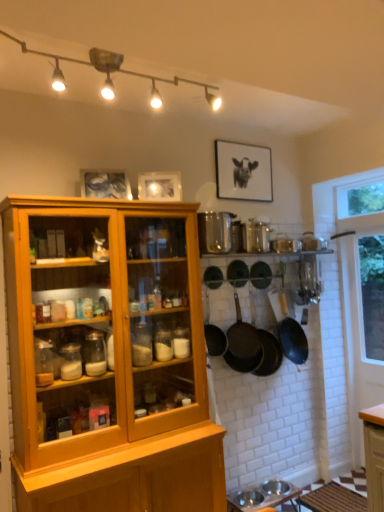
Question: Is black matte picture frame at upper center, which is counted as the 1th picture frame, starting from the right, aimed at black matte frying pan at center, marked as the 5th frying pan in a right-to-left arrangement?

Choices:
 (A) yes
 (B) no

Answer: (B)

Question: Does black matte picture frame at upper center, which is counted as the 1th picture frame, starting from the right, have a larger size compared to black matte frying pan at center, marked as the 5th frying pan in a right-to-left arrangement?

Choices:
 (A) no
 (B) yes

Answer: (A)

Question: Is black matte frying pan at center, marked as the 2th frying pan in a left-to-right arrangement, located within black matte picture frame at upper center, which ranks as the third picture frame in left-to-right order?

Choices:
 (A) no
 (B) yes

Answer: (A)

Question: Considering the relative sizes of black matte picture frame at upper center, which is counted as the 1th picture frame, starting from the right, and black matte frying pan at center, marked as the 2th frying pan in a left-to-right arrangement, in the image provided, is black matte picture frame at upper center, which is counted as the 1th picture frame, starting from the right, thinner than black matte frying pan at center, marked as the 2th frying pan in a left-to-right arrangement,?

Choices:
 (A) no
 (B) yes

Answer: (B)

Question: Does black matte picture frame at upper center, the 3th picture frame positioned from the front, have a lesser height compared to black matte frying pan at center, marked as the 5th frying pan in a right-to-left arrangement?

Choices:
 (A) yes
 (B) no

Answer: (A)

Question: From a real-world perspective, is black matte picture frame at upper center, the 3th picture frame positioned from the front, located higher than black matte frying pan at center, marked as the 2th frying pan in a left-to-right arrangement?

Choices:
 (A) yes
 (B) no

Answer: (A)

Question: Can you confirm if matte black frying pan at center, positioned as the first frying pan in left-to-right order, is shorter than white glass window at right?

Choices:
 (A) yes
 (B) no

Answer: (A)

Question: From a real-world perspective, is matte black frying pan at center, positioned as the first frying pan in left-to-right order, physically above white glass window at right?

Choices:
 (A) no
 (B) yes

Answer: (B)

Question: Is matte black frying pan at center, marked as the 6th frying pan in a right-to-left arrangement, with white glass window at right?

Choices:
 (A) yes
 (B) no

Answer: (B)

Question: From a real-world perspective, is matte black frying pan at center, marked as the 6th frying pan in a right-to-left arrangement, under white glass window at right?

Choices:
 (A) no
 (B) yes

Answer: (A)

Question: Is matte black frying pan at center, marked as the 6th frying pan in a right-to-left arrangement, at the right side of white glass window at right?

Choices:
 (A) no
 (B) yes

Answer: (A)

Question: From the image's perspective, does matte black frying pan at center, marked as the 6th frying pan in a right-to-left arrangement, appear lower than white glass window at right?

Choices:
 (A) yes
 (B) no

Answer: (B)

Question: Is metallic silver bowls at lower center, the second table viewed from the right, beside dark brown textured frying pan at center, the 3th frying pan when ordered from right to left?

Choices:
 (A) yes
 (B) no

Answer: (B)